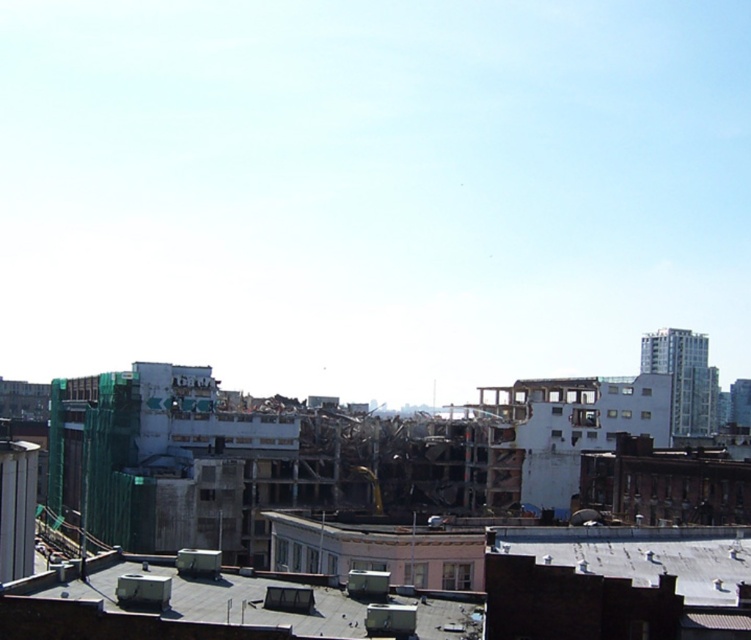
Question: Which point is closer to the camera?

Choices:
 (A) gray concrete roof at lower center
 (B) concrete rubble at center

Answer: (A)

Question: Which of the following is the farthest from the observer?

Choices:
 (A) (255, 618)
 (B) (680, 627)

Answer: (B)

Question: Is concrete rubble at center thinner than gray concrete roof at lower center?

Choices:
 (A) yes
 (B) no

Answer: (B)

Question: Among these points, which one is nearest to the camera?

Choices:
 (A) tap(424, 614)
 (B) tap(113, 516)

Answer: (A)

Question: Does concrete rubble at center have a smaller size compared to gray concrete roof at lower center?

Choices:
 (A) yes
 (B) no

Answer: (B)

Question: Does concrete rubble at center appear under gray concrete roof at lower center?

Choices:
 (A) no
 (B) yes

Answer: (B)